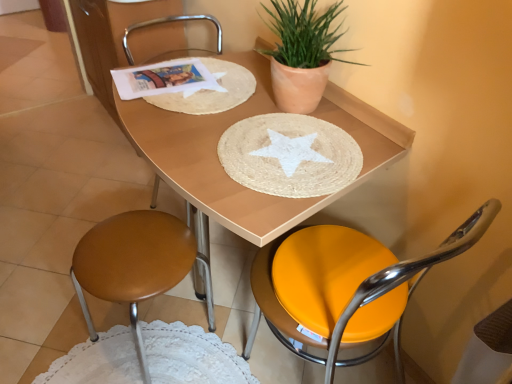
Image resolution: width=512 pixels, height=384 pixels. I want to click on vacant area located to the right-hand side of white paper at upper left, so click(245, 92).